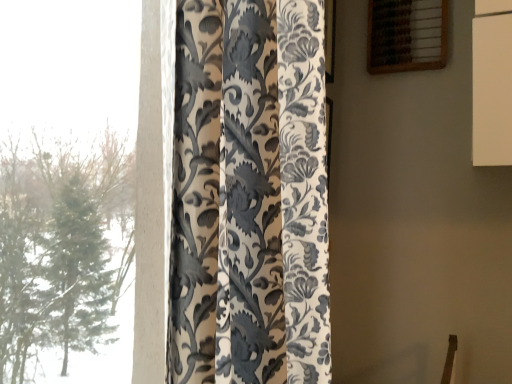
Question: Is the position of silky floral-patterned curtain at left less distant than that of wooden abacus at upper right?

Choices:
 (A) no
 (B) yes

Answer: (B)

Question: Can you confirm if silky floral-patterned curtain at left is positioned to the left of wooden abacus at upper right?

Choices:
 (A) no
 (B) yes

Answer: (B)

Question: Is silky floral-patterned curtain at left smaller than wooden abacus at upper right?

Choices:
 (A) yes
 (B) no

Answer: (B)

Question: Is silky floral-patterned curtain at left taller than wooden abacus at upper right?

Choices:
 (A) no
 (B) yes

Answer: (B)

Question: Is wooden abacus at upper right at the back of silky floral-patterned curtain at left?

Choices:
 (A) no
 (B) yes

Answer: (A)

Question: Does silky floral-patterned curtain at left touch wooden abacus at upper right?

Choices:
 (A) no
 (B) yes

Answer: (A)

Question: Does wooden abacus at upper right appear on the left side of silky floral-patterned curtain at left?

Choices:
 (A) no
 (B) yes

Answer: (A)

Question: Is wooden abacus at upper right with silky floral-patterned curtain at left?

Choices:
 (A) no
 (B) yes

Answer: (A)

Question: Is wooden abacus at upper right not inside silky floral-patterned curtain at left?

Choices:
 (A) yes
 (B) no

Answer: (A)

Question: From a real-world perspective, is wooden abacus at upper right positioned over silky floral-patterned curtain at left based on gravity?

Choices:
 (A) yes
 (B) no

Answer: (A)

Question: Is wooden abacus at upper right shorter than silky floral-patterned curtain at left?

Choices:
 (A) no
 (B) yes

Answer: (B)

Question: Does wooden abacus at upper right contain silky floral-patterned curtain at left?

Choices:
 (A) yes
 (B) no

Answer: (B)

Question: In terms of width, does silky floral-patterned curtain at left look wider or thinner when compared to wooden abacus at upper right?

Choices:
 (A) thin
 (B) wide

Answer: (B)